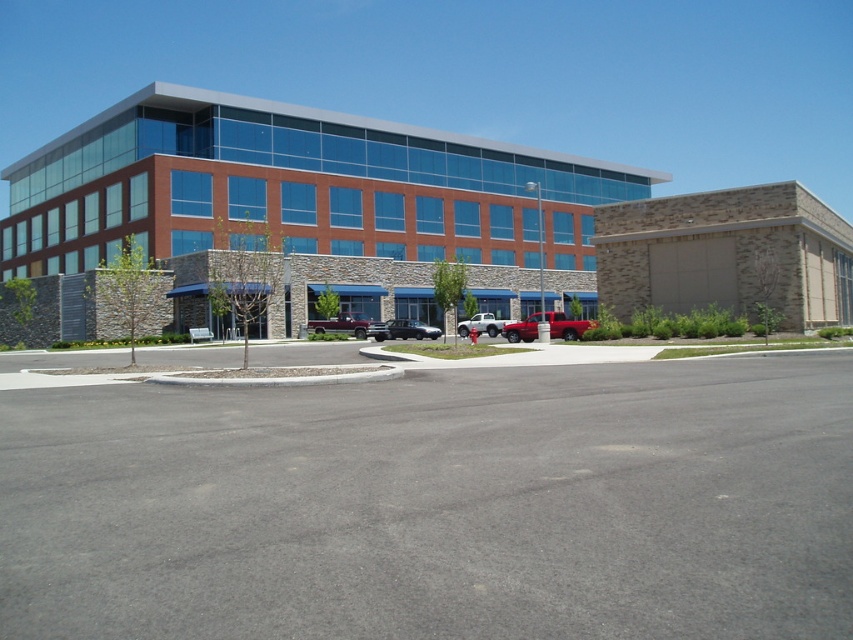
You are a delivery driver who needs to park your truck in the parking lot near the office building. You have a metallic red truck at center and a white matte truck at center. The parking space you want is between them. Is there enough space to fit your truck, which is 16 feet long, between the two trucks?

The metallic red truck at center is 18.87 feet away from the white matte truck at center. Since your truck is 16 feet long, there is enough space between them to park your truck.

You are standing at the point marked as point (436, 504) in the image. What material are you standing on?

You are standing on the gray asphalt parking lot at center.

You are a delivery person trying to park your 2.5 meter wide truck in the parking lot. There is a matte red truck at center and a white matte truck at center in the way. Can you determine if there is enough space between them to park your truck?

The matte red truck at center might be wider than white matte truck at center, so it is uncertain if there is enough space between them to park a 2.5 meter wide truck.